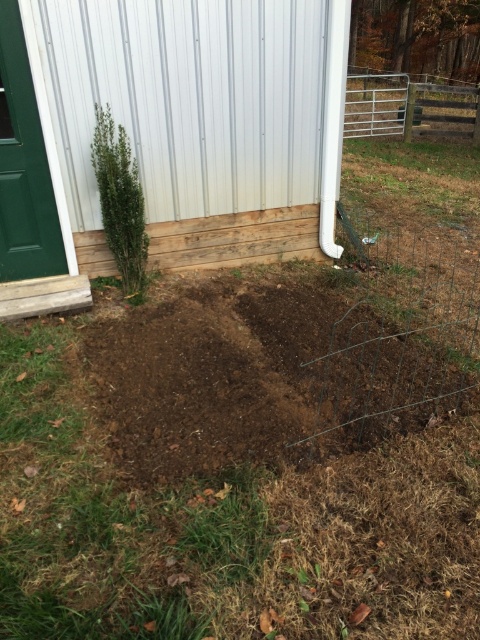
Question: Which object is farther from the camera taking this photo?

Choices:
 (A) dark brown soil at center
 (B) green leafy plant at left

Answer: (B)

Question: Is dark brown soil at center below green leafy plant at left?

Choices:
 (A) yes
 (B) no

Answer: (A)

Question: Observing the image, what is the correct spatial positioning of white metal gate at upper right in reference to green leafy plant at left?

Choices:
 (A) below
 (B) above

Answer: (B)

Question: Does dark brown soil at center have a lesser width compared to white metal gate at upper right?

Choices:
 (A) yes
 (B) no

Answer: (B)

Question: Which of the following is the farthest from the observer?

Choices:
 (A) white metal gate at upper right
 (B) dark brown soil at center

Answer: (A)

Question: Which point is farther to the camera?

Choices:
 (A) (x=133, y=202)
 (B) (x=355, y=131)
 (C) (x=300, y=292)

Answer: (B)